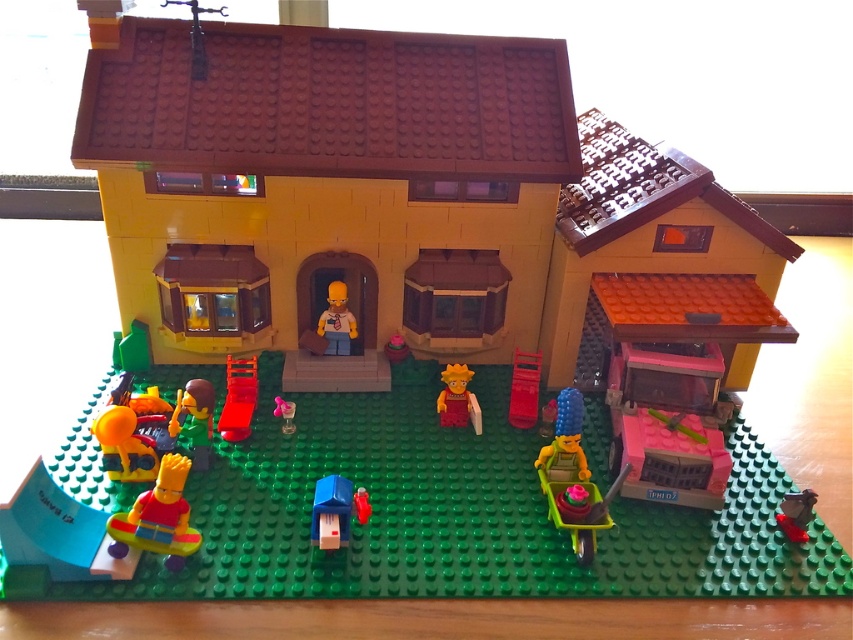
Consider the image. You are a LEGO figure trying to reach the rooftop of the house. You see a transparent plastic ladder at center and a metallic silver toy at lower right. Which object should you use to climb up?

You should use the transparent plastic ladder at center to climb up because it is located above the metallic silver toy at lower right, making it closer to the rooftop.

What is located at the coordinates point (331, 513) in the LEGO model?

The point (331, 513) indicates a smooth blue toy at center.

You are a LEGO figure standing at the entrance of the house. You see two points in the scene, point (241, 417) and point (782, 525). Which point is closer to you?

Point (241, 417) is closer to you because it is further to the viewer than point (782, 525).